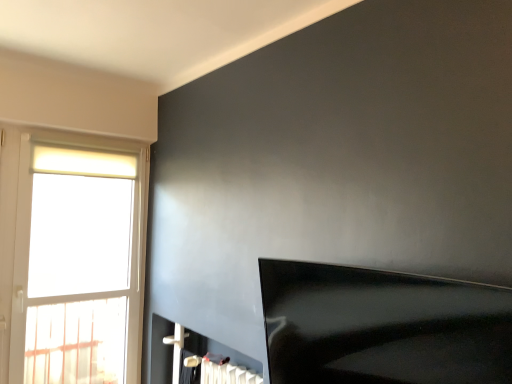
Question: Considering the relative sizes of black glossy tv at lower right and white glossy fireplace at lower center in the image provided, is black glossy tv at lower right wider than white glossy fireplace at lower center?

Choices:
 (A) no
 (B) yes

Answer: (B)

Question: Is white glossy fireplace at lower center surrounded by black glossy tv at lower right?

Choices:
 (A) no
 (B) yes

Answer: (A)

Question: From the image's perspective, does black glossy tv at lower right appear lower than white glossy fireplace at lower center?

Choices:
 (A) yes
 (B) no

Answer: (B)

Question: Is black glossy tv at lower right to the left of white glossy fireplace at lower center from the viewer's perspective?

Choices:
 (A) yes
 (B) no

Answer: (B)

Question: Does black glossy tv at lower right lie in front of white glossy fireplace at lower center?

Choices:
 (A) yes
 (B) no

Answer: (A)

Question: Does black glossy tv at lower right come behind white glossy fireplace at lower center?

Choices:
 (A) no
 (B) yes

Answer: (A)

Question: Considering the relative sizes of white glass window at left and white glossy fireplace at lower center in the image provided, is white glass window at left taller than white glossy fireplace at lower center?

Choices:
 (A) yes
 (B) no

Answer: (A)

Question: Does white glass window at left have a greater width compared to white glossy fireplace at lower center?

Choices:
 (A) no
 (B) yes

Answer: (A)

Question: Are white glass window at left and white glossy fireplace at lower center beside each other?

Choices:
 (A) yes
 (B) no

Answer: (B)

Question: Is the depth of white glass window at left greater than that of white glossy fireplace at lower center?

Choices:
 (A) no
 (B) yes

Answer: (B)

Question: From the image's perspective, is white glass window at left located beneath white glossy fireplace at lower center?

Choices:
 (A) yes
 (B) no

Answer: (B)

Question: Considering the relative sizes of white glass window at left and white glossy fireplace at lower center in the image provided, is white glass window at left shorter than white glossy fireplace at lower center?

Choices:
 (A) yes
 (B) no

Answer: (B)

Question: Is white glass window at left next to black glossy tv at lower right and touching it?

Choices:
 (A) no
 (B) yes

Answer: (A)